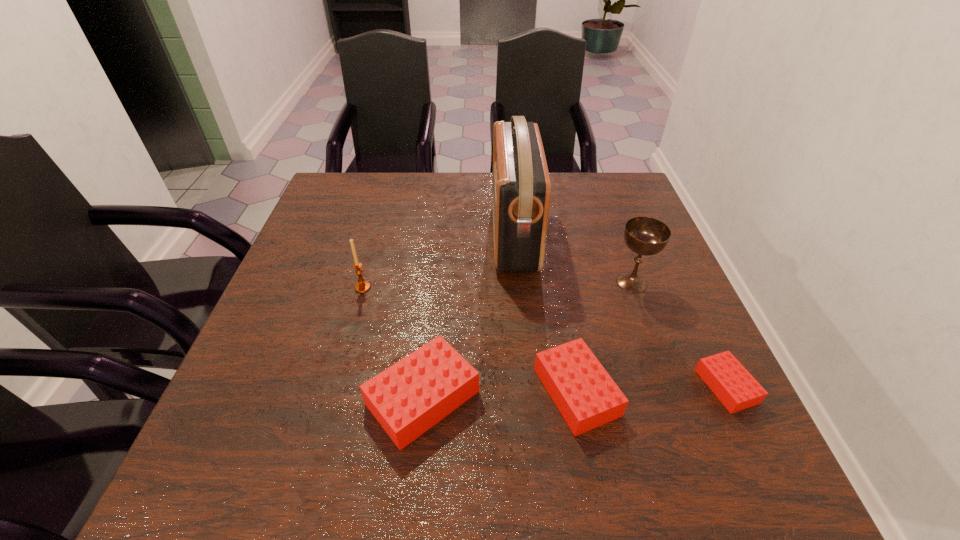
Identify the location of vacant position located on the back of the rightmost object. (698, 326).

Locate an element on the screen. This screenshot has height=540, width=960. free location located on the front-facing side of the tallest object is located at coordinates (414, 235).

Locate an element on the screen. Image resolution: width=960 pixels, height=540 pixels. blank area located 0.200m on the front-facing side of the tallest object is located at coordinates (418, 235).

This screenshot has width=960, height=540. Find the location of `vacant space located on the front-facing side of the tallest object`. vacant space located on the front-facing side of the tallest object is located at coordinates (376, 235).

At what (x,y) coordinates should I click in order to perform the action: click on vacant space located 0.340m on the front of the candle_holder. Please return your answer as a coordinate pair (x, y). The image size is (960, 540). Looking at the image, I should click on (323, 432).

This screenshot has height=540, width=960. In order to click on vacant area situated on the front of the second object from right to left in this screenshot , I will do `click(673, 397)`.

At what (x,y) coordinates should I click in order to perform the action: click on object located in the far edge section of the desktop. Please return your answer as a coordinate pair (x, y). Image resolution: width=960 pixels, height=540 pixels. Looking at the image, I should click on (521, 189).

Where is `Lego positioned at the right edge`? This screenshot has height=540, width=960. Lego positioned at the right edge is located at coordinates (734, 386).

You are a GUI agent. You are given a task and a screenshot of the screen. Output one action in this format:
    pyautogui.click(x=<x>, y=<y>)
    Task: Click on the chalice located in the right edge section of the desktop
    
    Given the screenshot: What is the action you would take?
    pyautogui.click(x=647, y=236)

Image resolution: width=960 pixels, height=540 pixels. I want to click on object situated at the near right corner, so click(734, 386).